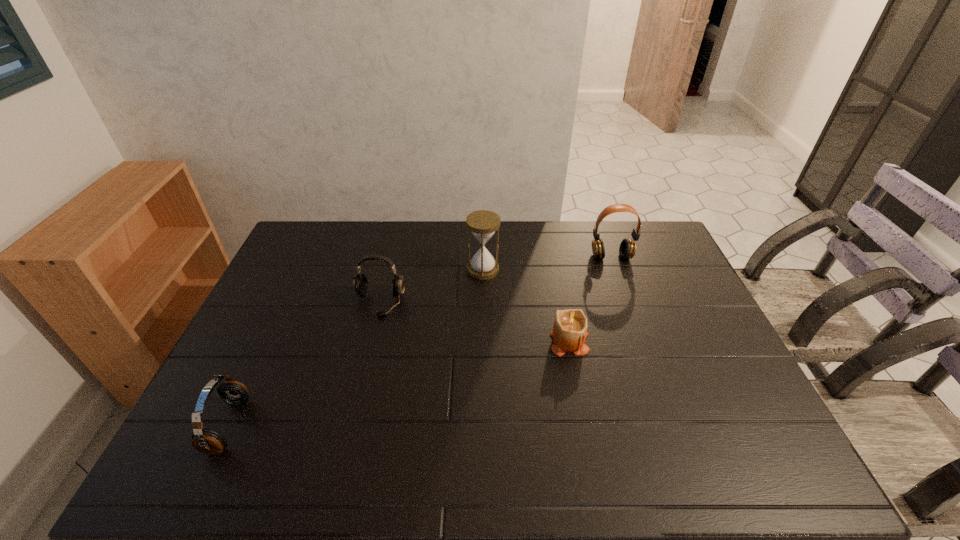
This screenshot has height=540, width=960. I want to click on object that is at the far right corner, so click(627, 249).

Identify the location of vacant region at the far edge of the desktop. (417, 246).

Where is `vacant space at the left edge of the desktop`? The width and height of the screenshot is (960, 540). vacant space at the left edge of the desktop is located at coordinates (285, 264).

This screenshot has height=540, width=960. I want to click on free spot at the right edge of the desktop, so click(662, 315).

Image resolution: width=960 pixels, height=540 pixels. In order to click on vacant region at the far left corner of the desktop in this screenshot , I will do `click(309, 260)`.

The height and width of the screenshot is (540, 960). Identify the location of free space at the far right corner of the desktop. (660, 258).

The image size is (960, 540). I want to click on free point between the second farthest headset and the rightmost headset, so click(495, 280).

The height and width of the screenshot is (540, 960). I want to click on unoccupied area between the third object from right to left and the second farthest headset, so click(x=431, y=286).

Where is `free space that is in between the farthest headset and the second object from left to right`? Image resolution: width=960 pixels, height=540 pixels. free space that is in between the farthest headset and the second object from left to right is located at coordinates (495, 280).

You are a GUI agent. You are given a task and a screenshot of the screen. Output one action in this format:
    pyautogui.click(x=<x>, y=<y>)
    Task: Click on the free spot between the hourglass and the second headset from left to right
    
    Given the screenshot: What is the action you would take?
    pyautogui.click(x=431, y=286)